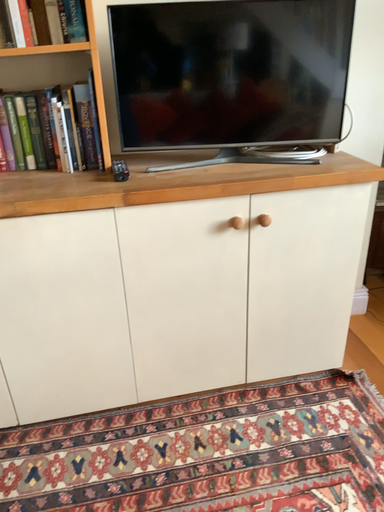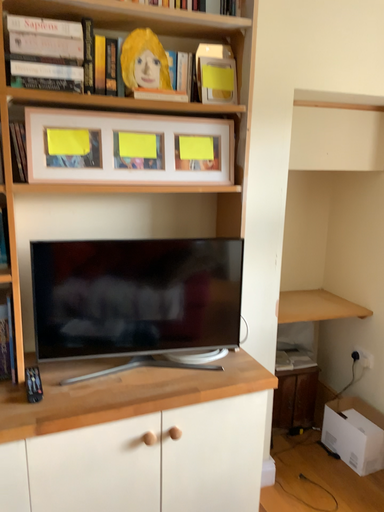
Question: How did the camera likely rotate when shooting the video?

Choices:
 (A) rotated downward
 (B) rotated upward

Answer: (B)